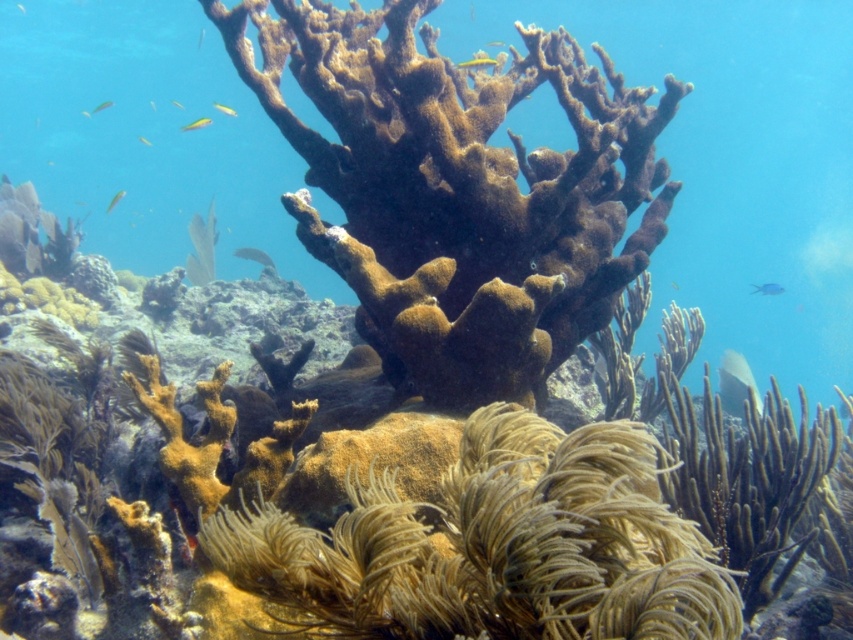
Question: Can you confirm if shiny green fish at center is smaller than translucent yellow fish at upper center?

Choices:
 (A) no
 (B) yes

Answer: (A)

Question: Which object appears farthest from the camera in this image?

Choices:
 (A) shiny yellow fish at upper center
 (B) yellow translucent fish at upper left
 (C) translucent yellow fish at upper center
 (D) translucent rubber fish at center

Answer: (C)

Question: Which point appears farthest from the camera in this image?

Choices:
 (A) (109, 200)
 (B) (753, 378)

Answer: (A)

Question: From the image, what is the correct spatial relationship of translucent yellowish fish at center in relation to translucent yellow fish at upper center?

Choices:
 (A) below
 (B) above

Answer: (A)

Question: Which of the following is the farthest from the observer?

Choices:
 (A) (672, 282)
 (B) (485, 58)
 (C) (106, 104)

Answer: (A)

Question: Does smooth gray fish at center appear under translucent yellow fish at upper left?

Choices:
 (A) yes
 (B) no

Answer: (A)